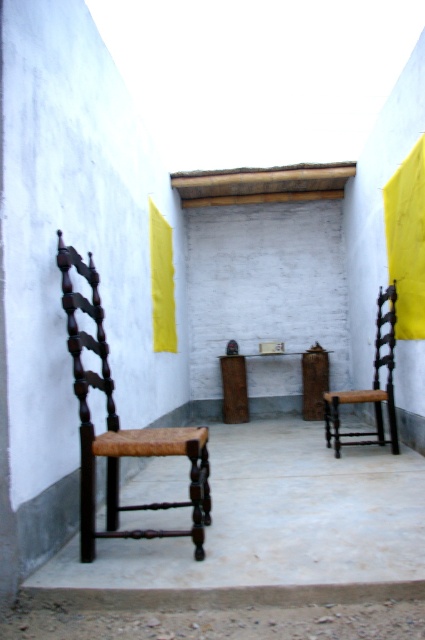
Is dark brown wood chair at right shorter than yellow fabric curtain at center?

Incorrect, dark brown wood chair at right's height does not fall short of yellow fabric curtain at center's.

Between point (342, 400) and point (163, 266), which one is positioned behind?

Positioned behind is point (163, 266).

Does point (393, 301) come farther from viewer compared to point (153, 259)?

No, (393, 301) is in front of (153, 259).

You are a GUI agent. You are given a task and a screenshot of the screen. Output one action in this format:
    pyautogui.click(x=<x>, y=<y>)
    Task: Click on the dark brown wood chair at right
    
    Given the screenshot: What is the action you would take?
    pyautogui.click(x=371, y=388)

Does point (70, 348) come closer to viewer compared to point (377, 342)?

That is True.

This screenshot has height=640, width=425. I want to click on dark brown wood chair at left, so click(x=121, y=429).

Where is `dark brown wood chair at left`? The image size is (425, 640). dark brown wood chair at left is located at coordinates (121, 429).

Is point (135, 532) in front of point (159, 225)?

Yes, point (135, 532) is closer to viewer.

Which is above, dark brown wood chair at left or yellow fabric curtain at center?

Positioned higher is yellow fabric curtain at center.

Between point (170, 428) and point (153, 262), which one is positioned behind?

The point (170, 428) is more distant.

Where is `dark brown wood chair at left`? This screenshot has width=425, height=640. dark brown wood chair at left is located at coordinates (121, 429).